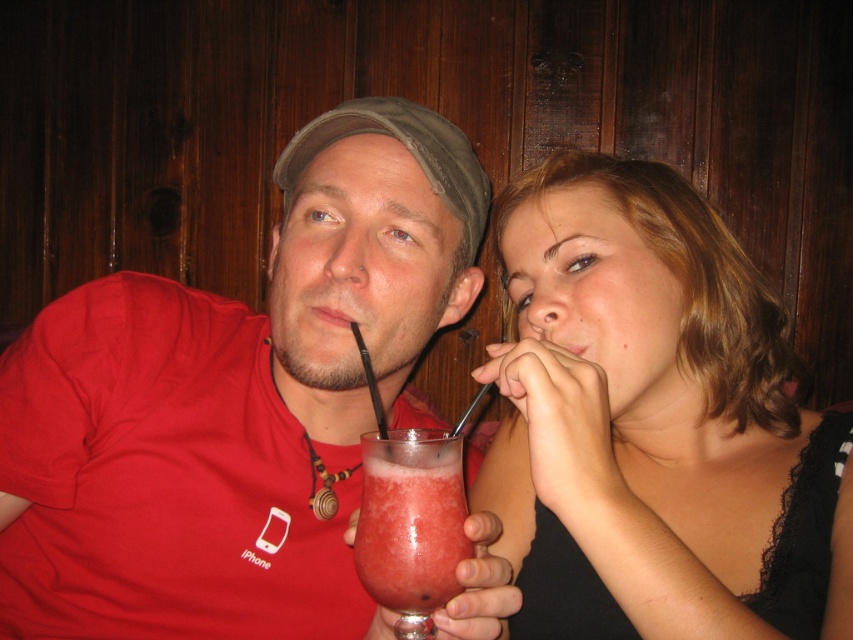
Can you confirm if matte red shirt at center is bigger than smoothie glass at center?

Yes, matte red shirt at center is bigger than smoothie glass at center.

Between matte red shirt at center and smoothie glass at center, which one appears on the right side from the viewer's perspective?

smoothie glass at center

Where is `matte red shirt at center`? matte red shirt at center is located at coordinates (235, 403).

Where is `matte red shirt at center`? Image resolution: width=853 pixels, height=640 pixels. matte red shirt at center is located at coordinates (235, 403).

Who is taller, matte red shirt at center or matte black drink at center?

matte red shirt at center is taller.

Who is more forward, (263, 499) or (677, 595)?

Point (677, 595) is more forward.

Where is `matte red shirt at center`? matte red shirt at center is located at coordinates (235, 403).

Who is more forward, (x=779, y=458) or (x=390, y=486)?

Point (x=390, y=486)

Describe the element at coordinates (654, 422) in the screenshot. I see `matte black drink at center` at that location.

Where is `matte black drink at center`? The image size is (853, 640). matte black drink at center is located at coordinates (654, 422).

Locate an element on the screen. The width and height of the screenshot is (853, 640). matte black drink at center is located at coordinates (654, 422).